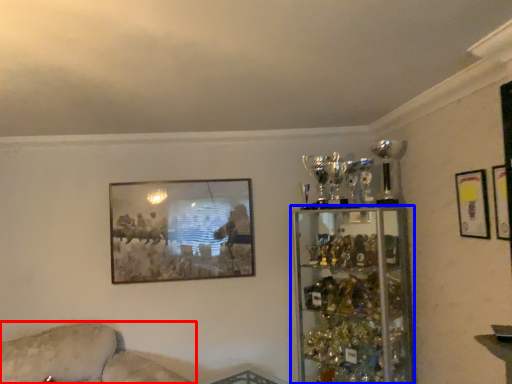
Question: Which object appears farthest to the camera in this image, couch (highlighted by a red box) or shelf (highlighted by a blue box)?

Choices:
 (A) couch
 (B) shelf

Answer: (B)